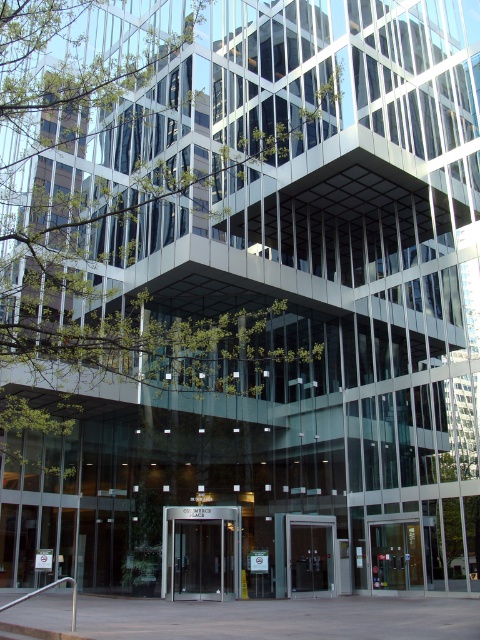
Question: Is dark brown glass door at center positioned in front of matte glass door at center?

Choices:
 (A) yes
 (B) no

Answer: (A)

Question: Which object appears farthest from the camera in this image?

Choices:
 (A) matte glass door at center
 (B) dark brown glass door at center

Answer: (A)

Question: Which of the following is the closest to the observer?

Choices:
 (A) (201, 518)
 (B) (305, 531)

Answer: (A)

Question: Is dark brown glass door at center below matte glass door at center?

Choices:
 (A) yes
 (B) no

Answer: (B)

Question: Which of the following is the closest to the observer?

Choices:
 (A) dark brown glass door at center
 (B) matte glass door at center

Answer: (A)

Question: Considering the relative positions of dark brown glass door at center and matte glass door at center in the image provided, where is dark brown glass door at center located with respect to matte glass door at center?

Choices:
 (A) right
 (B) left

Answer: (B)